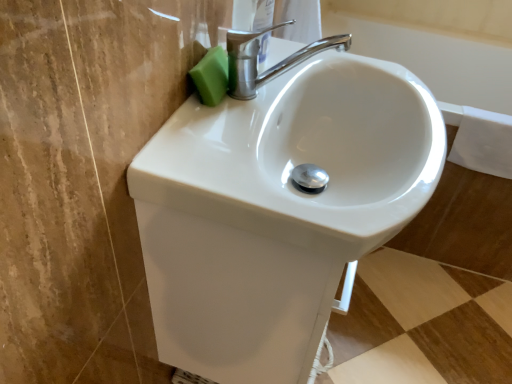
What is the approximate height of polished chrome faucet at upper center?

polished chrome faucet at upper center is 36.82 centimeters in height.

Find the location of a particular element. Image resolution: width=512 pixels, height=384 pixels. green sponge at upper left is located at coordinates (211, 76).

From the image's perspective, is polished chrome faucet at upper center on top of green sponge at upper left?

Yes, from the image's perspective, polished chrome faucet at upper center is over green sponge at upper left.

Could you tell me if polished chrome faucet at upper center is facing green sponge at upper left?

No, polished chrome faucet at upper center is not facing towards green sponge at upper left.

Can you confirm if polished chrome faucet at upper center is shorter than green sponge at upper left?

Incorrect, the height of polished chrome faucet at upper center does not fall short of that of green sponge at upper left.

This screenshot has width=512, height=384. I want to click on sink below the polished chrome faucet at upper center (from the image's perspective), so click(277, 210).

Measure the distance from white glossy sink at center to polished chrome faucet at upper center.

white glossy sink at center is 23.55 centimeters away from polished chrome faucet at upper center.

Is point (348, 76) farther from viewer compared to point (332, 38)?

No, it is in front of (332, 38).

Would you say white glossy sink at center contains polished chrome faucet at upper center?

Actually, polished chrome faucet at upper center is outside white glossy sink at center.

Is point (217, 63) closer or farther from the camera than point (241, 82)?

Point (217, 63).

Could you tell me if green sponge at upper left is facing polished chrome faucet at upper center?

No, green sponge at upper left is not turned towards polished chrome faucet at upper center.

Is green sponge at upper left not near white glossy sink at center?

green sponge at upper left is actually quite close to white glossy sink at center.

Which is in front, point (227, 57) or point (361, 97)?

Positioned in front is point (227, 57).

From the picture: Is green sponge at upper left further to camera compared to white glossy sink at center?

Yes, green sponge at upper left is behind white glossy sink at center.

From the image's perspective, is green sponge at upper left located beneath white glossy sink at center?

Incorrect, from the image's perspective, green sponge at upper left is higher than white glossy sink at center.

Consider the image. In the image, is white glossy sink at center on the left side or the right side of green sponge at upper left?

white glossy sink at center is positioned on green sponge at upper left's right side.

From a real-world perspective, is white glossy sink at center positioned over green sponge at upper left based on gravity?

No.

Between white glossy sink at center and green sponge at upper left, which one has less height?

With less height is green sponge at upper left.

Which object is more forward, white glossy sink at center or green sponge at upper left?

white glossy sink at center is more forward.

Which of these two, polished chrome faucet at upper center or white glossy sink at center, stands taller?

With more height is polished chrome faucet at upper center.

Which is more to the left, polished chrome faucet at upper center or white glossy sink at center?

From the viewer's perspective, white glossy sink at center appears more on the left side.

Measure the distance between polished chrome faucet at upper center and white glossy sink at center.

9.27 inches.

Considering the positions of point (335, 43) and point (211, 362), is point (335, 43) closer or farther from the camera than point (211, 362)?

Clearly, point (335, 43) is more distant from the camera than point (211, 362).

The height and width of the screenshot is (384, 512). I want to click on soap that is on the left side of polished chrome faucet at upper center, so click(x=211, y=76).

Locate an element on the screen. tap on the right of white glossy sink at center is located at coordinates (272, 66).

Based on their spatial positions, is polished chrome faucet at upper center or green sponge at upper left closer to white glossy sink at center?

polished chrome faucet at upper center is closer to white glossy sink at center.

When comparing their distances from green sponge at upper left, does white glossy sink at center or polished chrome faucet at upper center seem closer?

Among the two, polished chrome faucet at upper center is located nearer to green sponge at upper left.

Consider the image. When comparing their distances from white glossy sink at center, does green sponge at upper left or polished chrome faucet at upper center seem further?

green sponge at upper left lies further to white glossy sink at center than the other object.

From the image, which object appears to be farther from green sponge at upper left, polished chrome faucet at upper center or white glossy sink at center?

The object further to green sponge at upper left is white glossy sink at center.

Looking at the image, which one is located further to polished chrome faucet at upper center, green sponge at upper left or white glossy sink at center?

Based on the image, white glossy sink at center appears to be further to polished chrome faucet at upper center.

Considering their positions, is white glossy sink at center positioned closer to polished chrome faucet at upper center than green sponge at upper left?

green sponge at upper left.

You are a GUI agent. You are given a task and a screenshot of the screen. Output one action in this format:
    pyautogui.click(x=<x>, y=<y>)
    Task: Click on the soap between white glossy sink at center and polished chrome faucet at upper center in the front-back direction
    
    Given the screenshot: What is the action you would take?
    pyautogui.click(x=211, y=76)